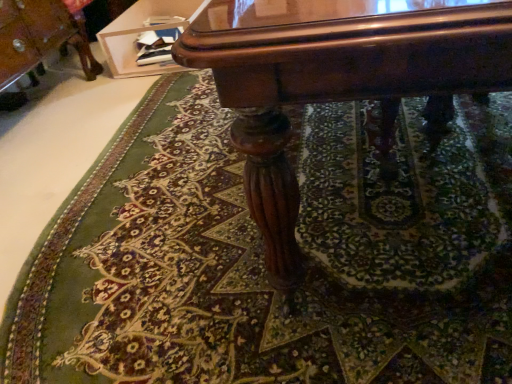
Question: In terms of size, does wooden glossy vanity at upper center appear bigger or smaller than glossy wood table at center?

Choices:
 (A) big
 (B) small

Answer: (B)

Question: Which is correct: wooden glossy vanity at upper center is inside glossy wood table at center, or outside of it?

Choices:
 (A) outside
 (B) inside

Answer: (A)

Question: Is point (129, 34) positioned closer to the camera than point (441, 110)?

Choices:
 (A) closer
 (B) farther

Answer: (B)

Question: In terms of height, does glossy wood table at center look taller or shorter compared to wooden glossy vanity at upper center?

Choices:
 (A) short
 (B) tall

Answer: (B)

Question: From the image's perspective, is glossy wood table at center positioned above or below wooden glossy vanity at upper center?

Choices:
 (A) above
 (B) below

Answer: (B)

Question: Would you say glossy wood table at center is to the left or to the right of wooden glossy vanity at upper center in the picture?

Choices:
 (A) left
 (B) right

Answer: (B)

Question: Looking at the image, does glossy wood table at center seem bigger or smaller compared to wooden glossy vanity at upper center?

Choices:
 (A) small
 (B) big

Answer: (B)